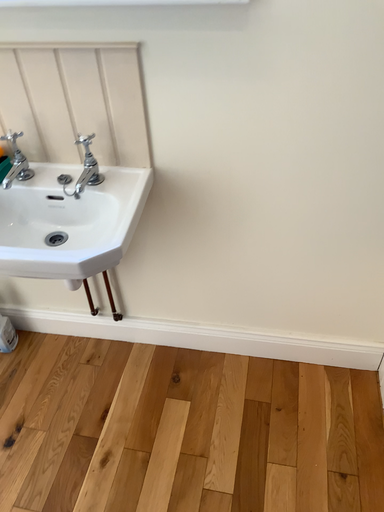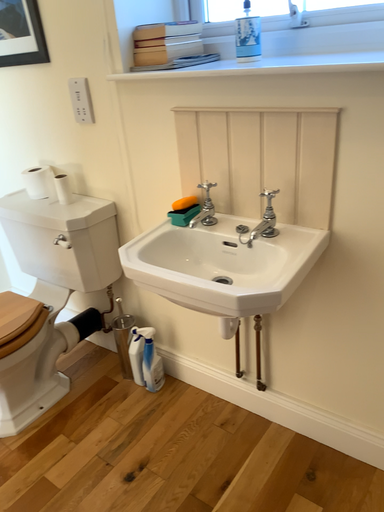
Question: How did the camera likely rotate when shooting the video?

Choices:
 (A) rotated right
 (B) rotated left

Answer: (B)